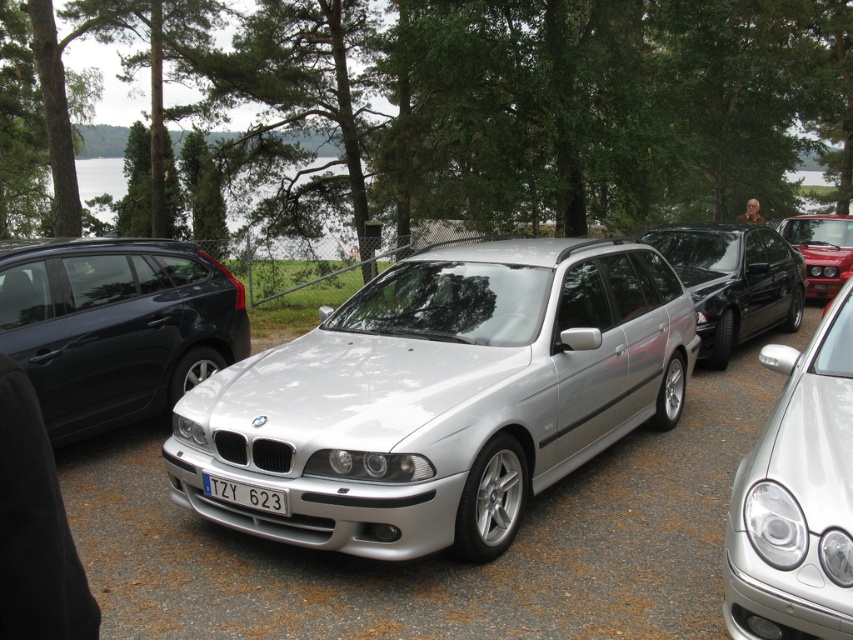
Question: Is matte black station wagon at left positioned in front of satin silver car at center?

Choices:
 (A) yes
 (B) no

Answer: (B)

Question: Can you confirm if satin black sedan at center is positioned below white plastic license plate at center?

Choices:
 (A) yes
 (B) no

Answer: (B)

Question: Among these objects, which one is farthest from the camera?

Choices:
 (A) matte black station wagon at left
 (B) shiny red car at center
 (C) satin black sedan at center
 (D) silver metallic car at center

Answer: (B)

Question: Which object is positioned closest to the silver metallic car at center?

Choices:
 (A) satin black sedan at center
 (B) white plastic license plate at center

Answer: (B)

Question: Is matte black station wagon at left to the right of shiny red car at center from the viewer's perspective?

Choices:
 (A) no
 (B) yes

Answer: (A)

Question: Which point is farther to the camera?

Choices:
 (A) matte black station wagon at left
 (B) white plastic license plate at center
 (C) satin black sedan at center
 (D) satin silver car at center

Answer: (C)